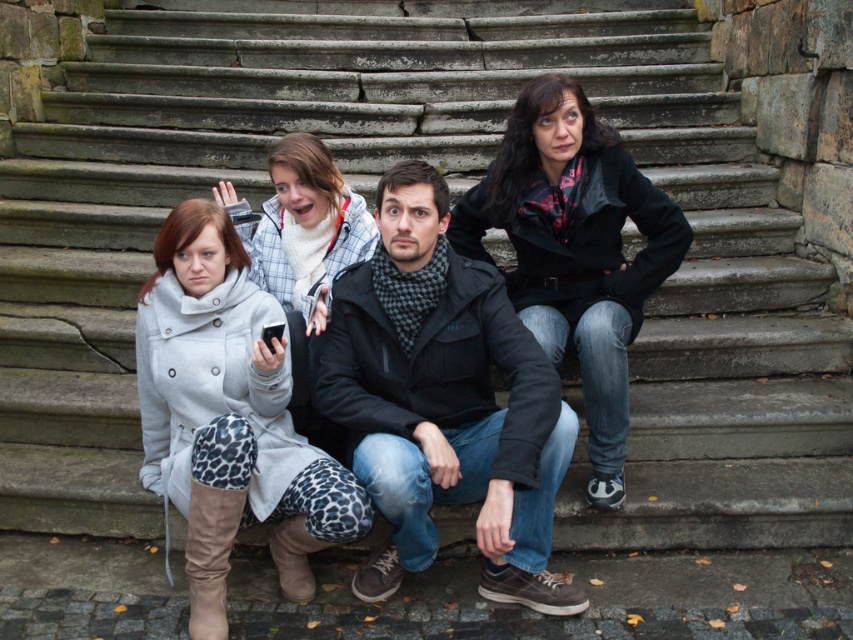
You are trying to determine the order of the jackets in the image. Which jacket is positioned closer to the viewer between the dark gray matte jacket at center and the black leather jacket at center?

The dark gray matte jacket at center is positioned closer to the viewer than the black leather jacket at center.

You are a photographer trying to decide which jacket to focus on for a closeup shot. Since you want the jacket to fill more of the frame, which one should you choose between the dark gray matte jacket at center and the black leather jacket at center?

The dark gray matte jacket at center is larger in size than the black leather jacket at center, so you should choose the dark gray matte jacket at center to fill more of the frame.